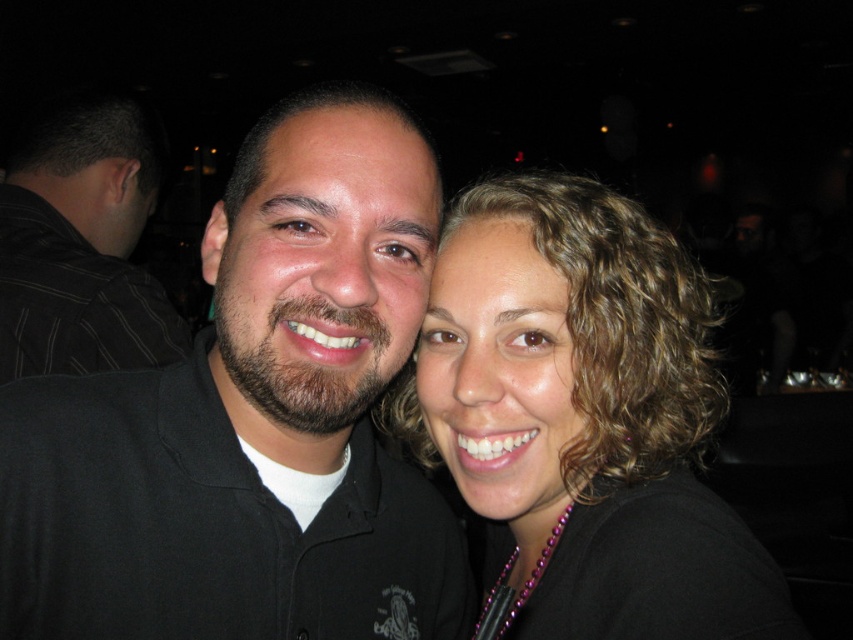
Can you confirm if curly hair at center is positioned below black striped shirt at left?

Correct, curly hair at center is located below black striped shirt at left.

Is curly hair at center further to the viewer compared to black striped shirt at left?

No, curly hair at center is closer to the viewer.

Does point (677, 552) lie behind point (83, 220)?

No, (677, 552) is closer to viewer.

The image size is (853, 640). What are the coordinates of `curly hair at center` in the screenshot? It's located at (585, 416).